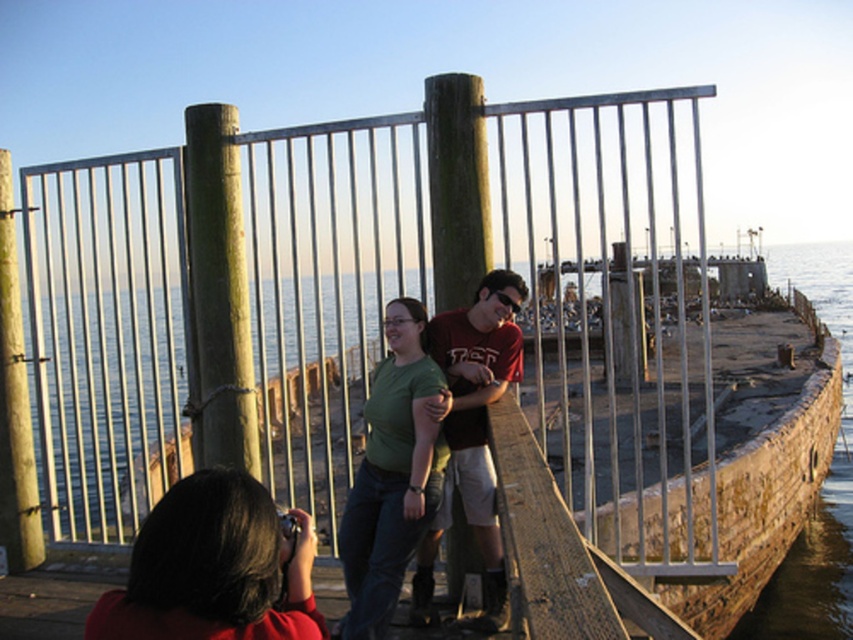
Which is above, matte black camera at lower left or matte red t-shirt at center?

matte black camera at lower left is above.

Who is more forward, [262,580] or [456,387]?

Point [262,580]

The height and width of the screenshot is (640, 853). In order to click on matte black camera at lower left in this screenshot , I will do 213,568.

Is metallic gate at center to the right of green matte shirt at center from the viewer's perspective?

Yes, metallic gate at center is to the right of green matte shirt at center.

Between metallic gate at center and green matte shirt at center, which one has more height?

Standing taller between the two is metallic gate at center.

What do you see at coordinates (375, 307) in the screenshot? The width and height of the screenshot is (853, 640). I see `metallic gate at center` at bounding box center [375, 307].

The width and height of the screenshot is (853, 640). I want to click on metallic gate at center, so click(375, 307).

Which is more to the left, matte black camera at lower left or green matte shirt at center?

matte black camera at lower left

Looking at this image, is matte black camera at lower left closer to camera compared to green matte shirt at center?

Yes, matte black camera at lower left is closer to the viewer.

Which is behind, point (202, 486) or point (384, 362)?

The point (384, 362) is more distant.

At what (x,y) coordinates should I click in order to perform the action: click on matte black camera at lower left. Please return your answer as a coordinate pair (x, y). Looking at the image, I should click on pyautogui.click(x=213, y=568).